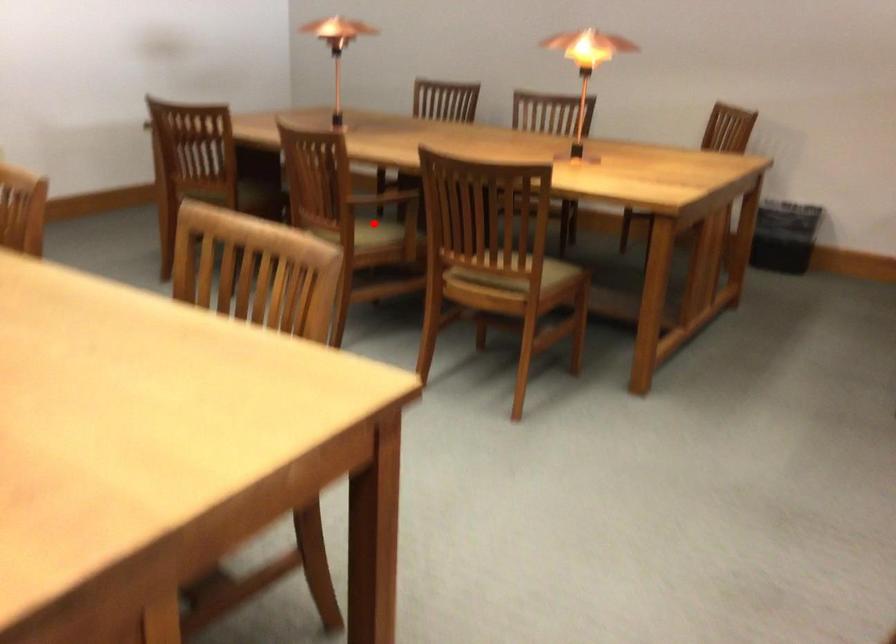
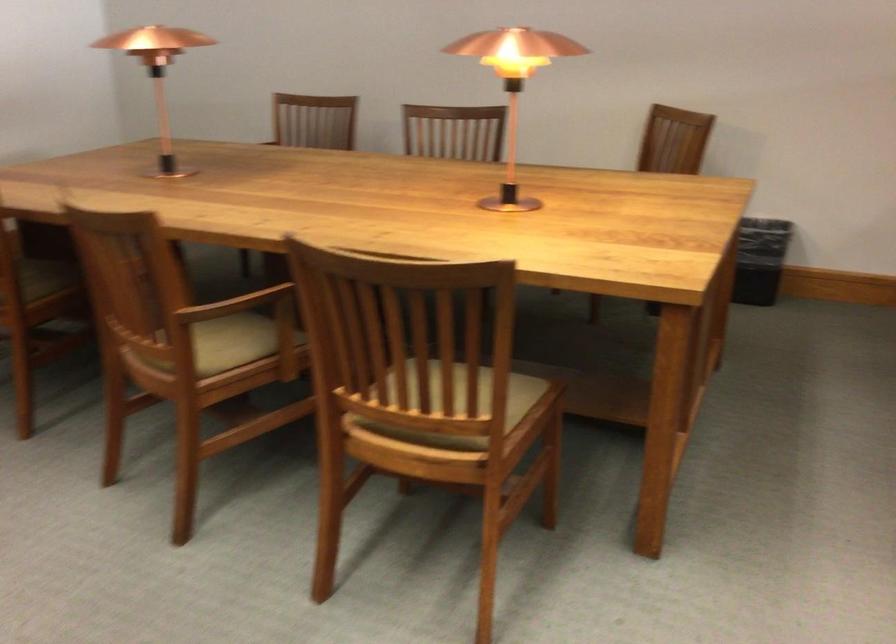
Where in the second image is the point corresponding to the highlighted location from the first image?

(228, 343)